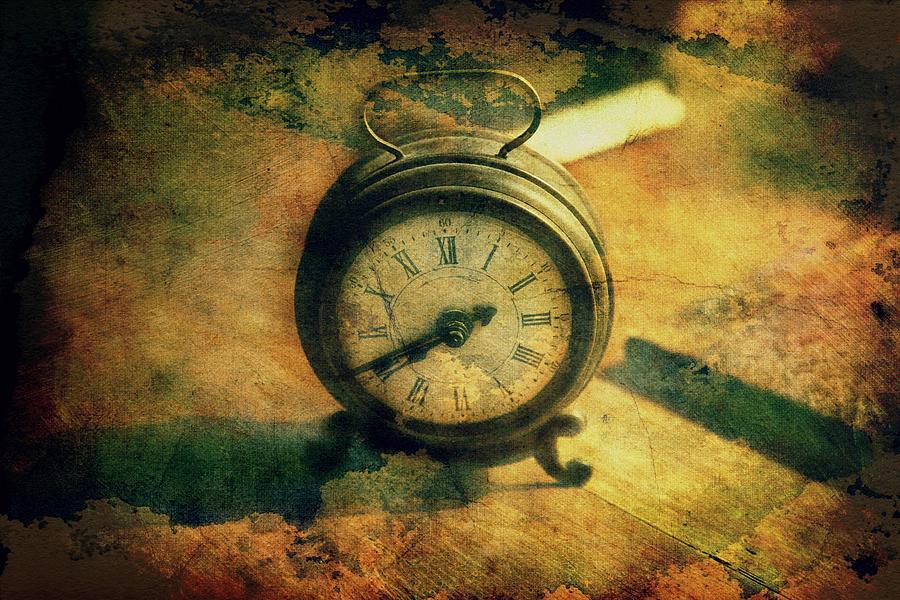
Locate an element on the screen. brass housing of painting of alarm clock is located at coordinates (529, 182), (465, 168), (381, 171), (337, 223), (590, 334), (479, 427), (330, 399).